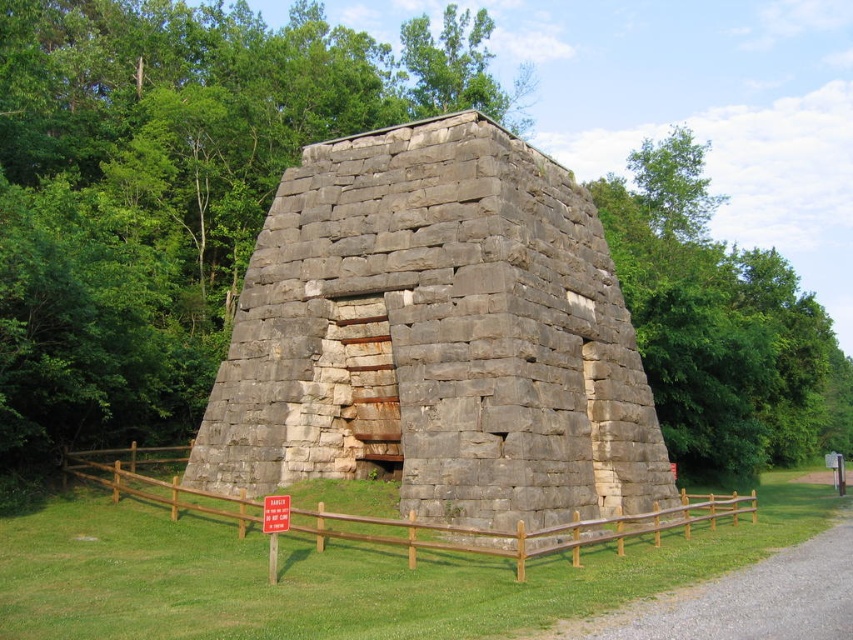
Does brown wooden fence at center appear over red plastic sign at center?

No, brown wooden fence at center is not above red plastic sign at center.

Is brown wooden fence at center below red plastic sign at center?

Indeed, brown wooden fence at center is positioned under red plastic sign at center.

Does point (523, 563) come in front of point (262, 506)?

Yes.

Find the location of `brown wooden fence at center`. brown wooden fence at center is located at coordinates (521, 529).

Does green leafy tree at center have a lesser width compared to brown wooden fence at center?

Yes.

Between green leafy tree at center and brown wooden fence at center, which one appears on the right side from the viewer's perspective?

Positioned to the right is brown wooden fence at center.

The image size is (853, 640). What do you see at coordinates (167, 188) in the screenshot?
I see `green leafy tree at center` at bounding box center [167, 188].

This screenshot has height=640, width=853. I want to click on green leafy tree at center, so click(167, 188).

Is gray stone structure at center to the right of red plastic sign at center from the viewer's perspective?

Yes, gray stone structure at center is to the right of red plastic sign at center.

Is gray stone structure at center bigger than red plastic sign at center?

Yes.

Find the location of a particular element. The height and width of the screenshot is (640, 853). gray stone structure at center is located at coordinates (439, 342).

Find the location of `gray stone structure at center`. gray stone structure at center is located at coordinates (439, 342).